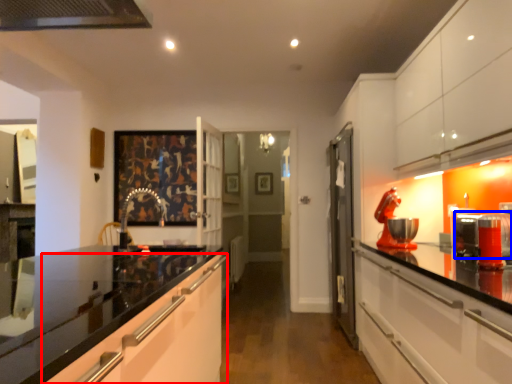
Question: Which point is further to the camera, cabinetry (highlighted by a red box) or appliance (highlighted by a blue box)?

Choices:
 (A) cabinetry
 (B) appliance

Answer: (B)